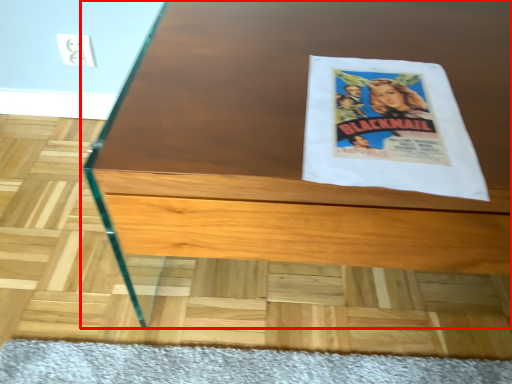
Question: From the image's perspective, where is table (annotated by the red box) located relative to flyer?

Choices:
 (A) below
 (B) above

Answer: (A)